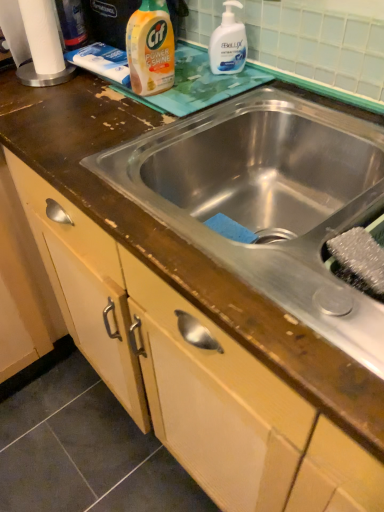
Locate an element on the screen. The height and width of the screenshot is (512, 384). vacant area that lies between white glossy hand soap at upper right, which ranks as the second cleaning product in left-to-right order, and yellow plastic bottle at upper center, marked as the first cleaning product in a left-to-right arrangement is located at coordinates (192, 82).